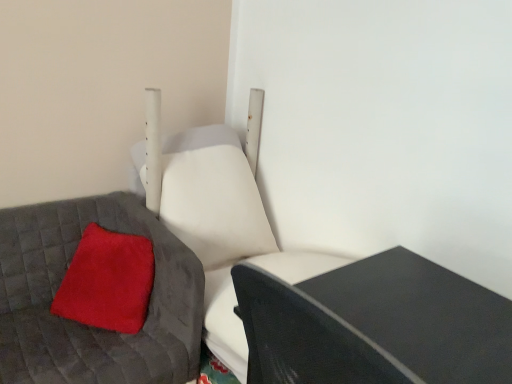
Question: In the image, is black matte table at lower right on the left side or the right side of fuzzy red pillow at lower left?

Choices:
 (A) left
 (B) right

Answer: (B)

Question: In terms of height, does black matte table at lower right look taller or shorter compared to fuzzy red pillow at lower left?

Choices:
 (A) short
 (B) tall

Answer: (B)

Question: Which object is positioned farthest from the white leather swivel chair at center?

Choices:
 (A) black matte table at lower right
 (B) velvety red pillow at left
 (C) fuzzy red pillow at lower left

Answer: (A)

Question: Estimate the real-world distances between objects in this image. Which object is closer to the velvety red pillow at left?

Choices:
 (A) white leather swivel chair at center
 (B) black matte table at lower right
 (C) fuzzy red pillow at lower left

Answer: (C)